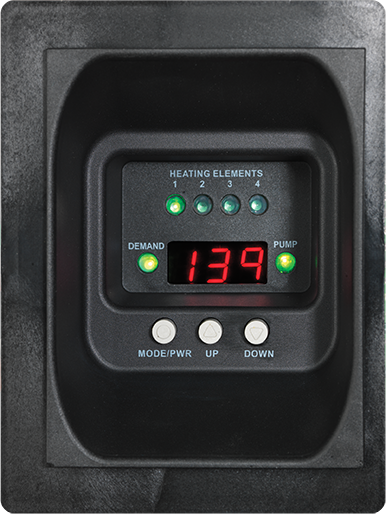
Image resolution: width=386 pixels, height=514 pixels. I want to click on led, so click(150, 261), click(284, 258).